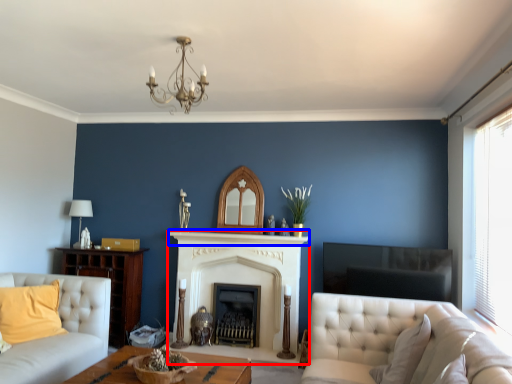
Question: Which of the following is the closest to the observer, fireplace (highlighted by a red box) or mantle (highlighted by a blue box)?

Choices:
 (A) fireplace
 (B) mantle

Answer: (B)